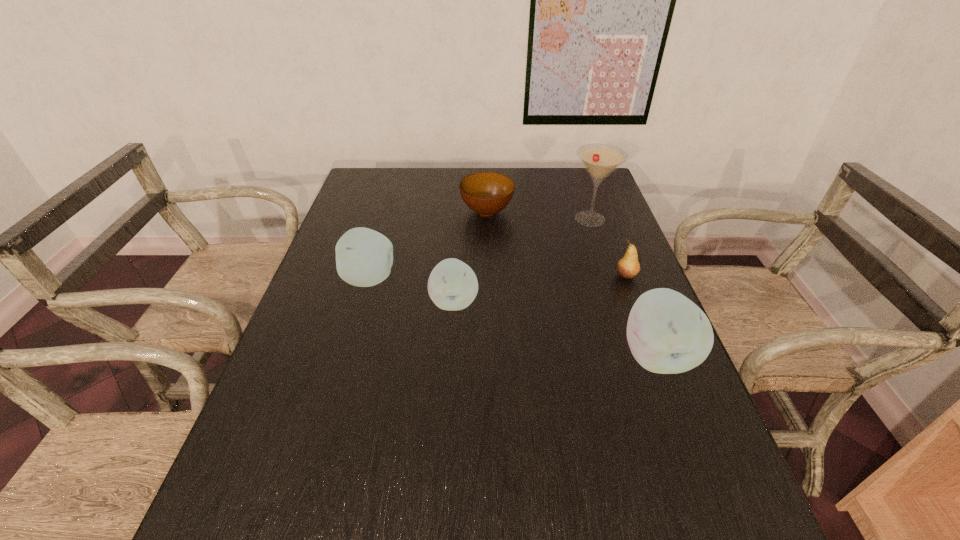
This screenshot has width=960, height=540. Find the location of `the leftmost apple`. the leftmost apple is located at coordinates (364, 257).

This screenshot has height=540, width=960. In order to click on the leftmost object in this screenshot , I will do `click(364, 257)`.

I want to click on the shortest apple, so click(452, 285).

Where is `the rightmost apple`? The height and width of the screenshot is (540, 960). the rightmost apple is located at coordinates (667, 333).

At what (x,y) coordinates should I click in order to perform the action: click on the nearest apple. Please return your answer as a coordinate pair (x, y). The image size is (960, 540). Looking at the image, I should click on (667, 333).

At what (x,y) coordinates should I click in order to perform the action: click on bowl. Please return your answer as a coordinate pair (x, y). Looking at the image, I should click on (486, 193).

You are a GUI agent. You are given a task and a screenshot of the screen. Output one action in this format:
    pyautogui.click(x=<x>, y=<y>)
    Task: Click on the martini
    Image resolution: width=960 pixels, height=540 pixels.
    Given the screenshot: What is the action you would take?
    coord(600,160)

What are the coordinates of `pear` in the screenshot? It's located at coord(627,267).

The height and width of the screenshot is (540, 960). I want to click on vacant space situated on the right of the second shortest apple, so click(429, 279).

Image resolution: width=960 pixels, height=540 pixels. Find the location of `vacant space situated 0.160m on the front of the second apple from right to left`. vacant space situated 0.160m on the front of the second apple from right to left is located at coordinates (450, 372).